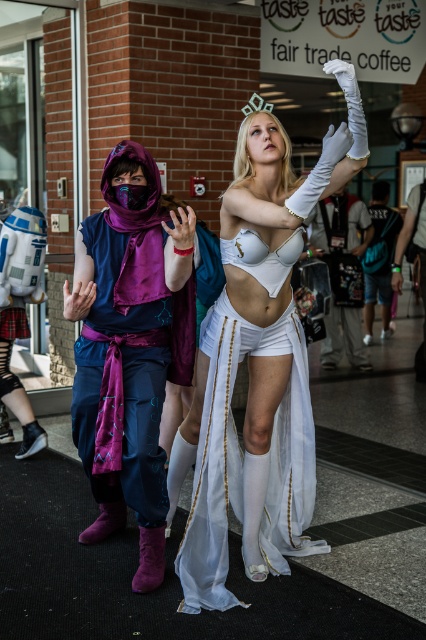
Question: Among these points, which one is farthest from the camera?

Choices:
 (A) (322, 180)
 (B) (138, 273)

Answer: (B)

Question: Which of the following is the farthest from the observer?

Choices:
 (A) (155, 224)
 (B) (256, 550)

Answer: (B)

Question: Can you confirm if white satin dress at center is positioned above purple velvet scarf at left?

Choices:
 (A) yes
 (B) no

Answer: (A)

Question: Does white satin dress at center come behind purple velvet scarf at left?

Choices:
 (A) yes
 (B) no

Answer: (B)

Question: Can you confirm if white satin dress at center is positioned to the left of purple velvet scarf at left?

Choices:
 (A) yes
 (B) no

Answer: (B)